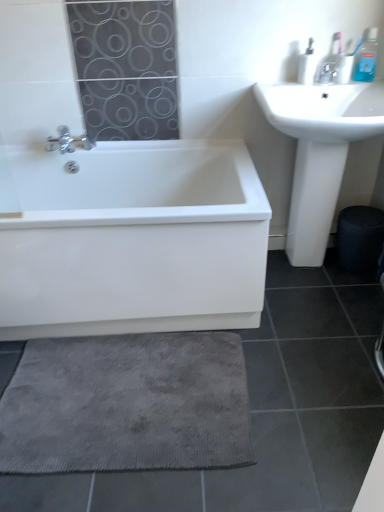
Question: Is white glossy bathtub at lower left to the left of gray textured bath mat at lower center from the viewer's perspective?

Choices:
 (A) yes
 (B) no

Answer: (A)

Question: Does white glossy bathtub at lower left have a lesser height compared to gray textured bath mat at lower center?

Choices:
 (A) yes
 (B) no

Answer: (B)

Question: Is white glossy bathtub at lower left aimed at gray textured bath mat at lower center?

Choices:
 (A) no
 (B) yes

Answer: (B)

Question: Is white glossy bathtub at lower left not inside gray textured bath mat at lower center?

Choices:
 (A) yes
 (B) no

Answer: (A)

Question: Does white glossy bathtub at lower left have a larger size compared to gray textured bath mat at lower center?

Choices:
 (A) no
 (B) yes

Answer: (B)

Question: Considering the positions of gray textured bath mat at lower center and satin nickel faucet at upper right in the image, is gray textured bath mat at lower center wider or thinner than satin nickel faucet at upper right?

Choices:
 (A) wide
 (B) thin

Answer: (A)

Question: Do you think gray textured bath mat at lower center is within satin nickel faucet at upper right, or outside of it?

Choices:
 (A) inside
 (B) outside

Answer: (B)

Question: Considering the positions of gray textured bath mat at lower center and satin nickel faucet at upper right in the image, is gray textured bath mat at lower center taller or shorter than satin nickel faucet at upper right?

Choices:
 (A) short
 (B) tall

Answer: (A)

Question: Is point (24, 358) closer or farther from the camera than point (327, 68)?

Choices:
 (A) farther
 (B) closer

Answer: (B)

Question: In the image, is satin nickel faucet at upper right on the left side or the right side of gray textured bath mat at lower center?

Choices:
 (A) right
 (B) left

Answer: (A)

Question: Is satin nickel faucet at upper right bigger or smaller than gray textured bath mat at lower center?

Choices:
 (A) small
 (B) big

Answer: (A)

Question: From their relative heights in the image, would you say satin nickel faucet at upper right is taller or shorter than gray textured bath mat at lower center?

Choices:
 (A) tall
 (B) short

Answer: (A)

Question: Is satin nickel faucet at upper right inside the boundaries of gray textured bath mat at lower center, or outside?

Choices:
 (A) inside
 (B) outside

Answer: (B)

Question: From a real-world perspective, relative to satin nickel faucet at upper right, is white plastic soap dispenser at upper right, which ranks as the second toiletry in right-to-left order, vertically above or below?

Choices:
 (A) below
 (B) above

Answer: (B)

Question: Is white plastic soap dispenser at upper right, which ranks as the first toiletry in left-to-right order, to the left or to the right of satin nickel faucet at upper right in the image?

Choices:
 (A) left
 (B) right

Answer: (A)